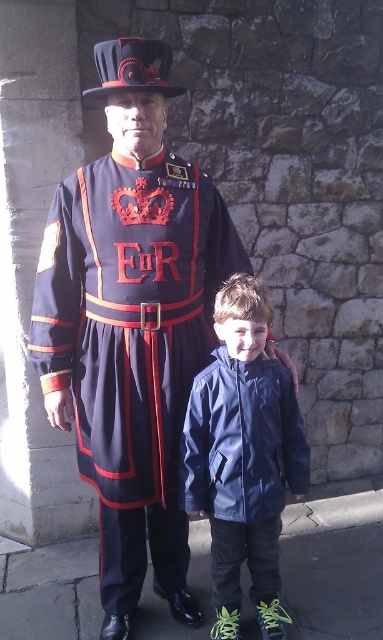
Question: Which of the following is the closest to the observer?

Choices:
 (A) matte black uniform at center
 (B) navy blue jacket at center

Answer: (A)

Question: Which of the following is the closest to the observer?

Choices:
 (A) (250, 296)
 (B) (106, 564)

Answer: (A)

Question: Which of the following is the closest to the observer?

Choices:
 (A) (199, 369)
 (B) (279, 429)

Answer: (B)

Question: Does matte black uniform at center come behind navy blue jacket at center?

Choices:
 (A) yes
 (B) no

Answer: (B)

Question: Is matte black uniform at center wider than navy blue jacket at center?

Choices:
 (A) yes
 (B) no

Answer: (A)

Question: Can you confirm if matte black uniform at center is positioned to the right of navy blue jacket at center?

Choices:
 (A) no
 (B) yes

Answer: (A)